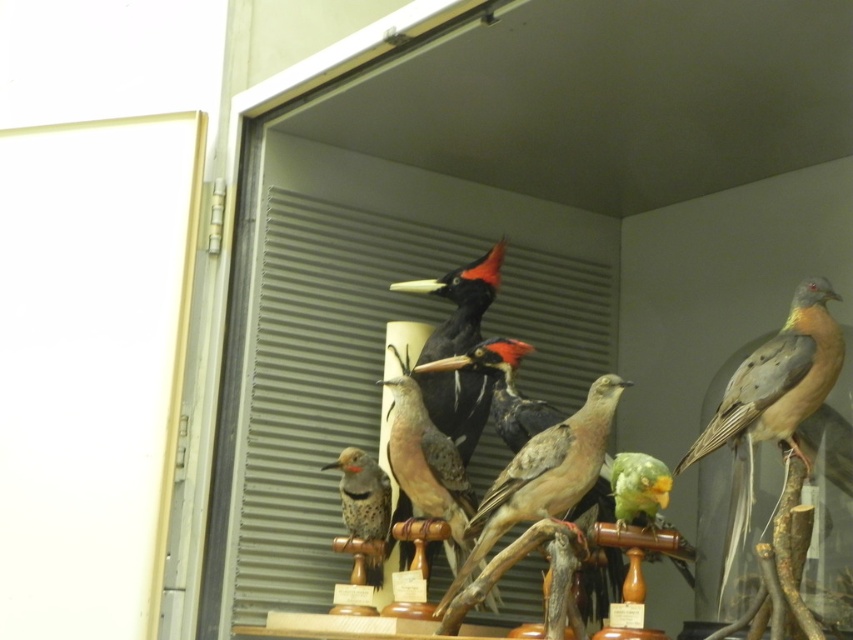
Question: Considering the real-world distances, which object is closest to the brown matte bird at right?

Choices:
 (A) black matte woodpecker at center
 (B) brown speckled feathers at center
 (C) matte brown woodpecker at center

Answer: (B)

Question: Considering the relative positions of brown matte bird at right and matte brown woodpecker at center in the image provided, where is brown matte bird at right located with respect to matte brown woodpecker at center?

Choices:
 (A) above
 (B) below

Answer: (A)

Question: Which object is farther from the camera taking this photo?

Choices:
 (A) black matte woodpecker at center
 (B) brown speckled feathers at center
 (C) brown matte bird at right
 (D) green matte parrot at center

Answer: (A)

Question: Which point is farther to the camera?

Choices:
 (A) click(x=821, y=371)
 (B) click(x=634, y=488)

Answer: (B)

Question: Can you confirm if brown matte bird at right is smaller than matte brown woodpecker at center?

Choices:
 (A) yes
 (B) no

Answer: (B)

Question: Is black matte woodpecker at center to the left of matte brown woodpecker at center from the viewer's perspective?

Choices:
 (A) yes
 (B) no

Answer: (B)